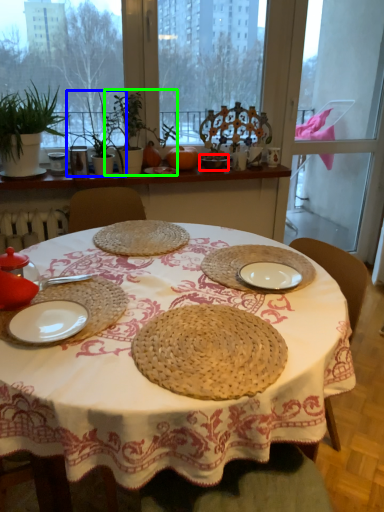
Question: Considering the real-world distances, which object is farthest from tableware (highlighted by a red box)? plant (highlighted by a blue box) or plant (highlighted by a green box)?

Choices:
 (A) plant
 (B) plant

Answer: (A)